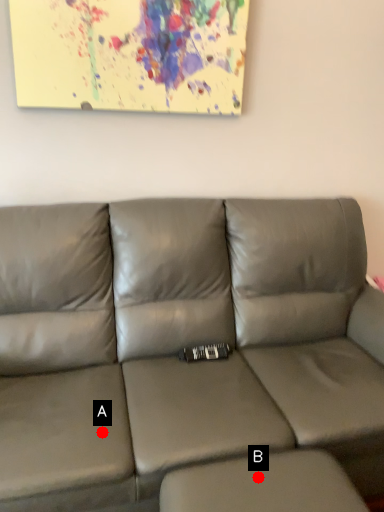
Question: Two points are circled on the image, labeled by A and B beside each circle. Which point is closer to the camera?

Choices:
 (A) A is closer
 (B) B is closer

Answer: (B)